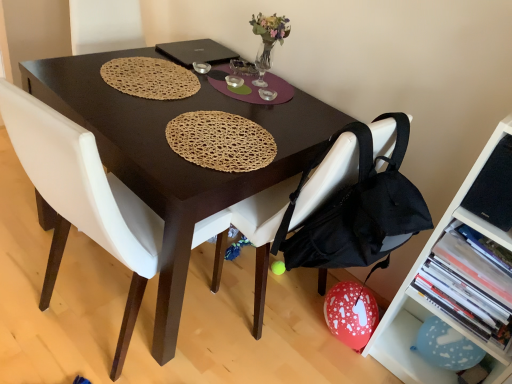
The height and width of the screenshot is (384, 512). What are the coordinates of `vacant area that is in front of black matte laptop at center` in the screenshot? It's located at (177, 70).